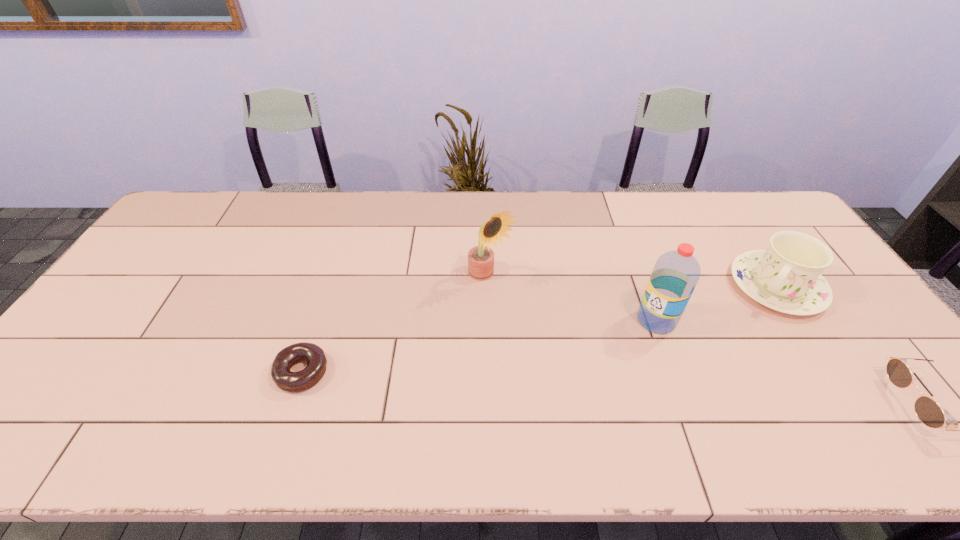
Where is `the shortest object`? This screenshot has width=960, height=540. the shortest object is located at coordinates (286, 380).

The height and width of the screenshot is (540, 960). Find the location of `the leftmost object`. the leftmost object is located at coordinates (286, 380).

This screenshot has width=960, height=540. Identify the location of chinaware. click(786, 277).

Locate an element on the screen. Image resolution: width=960 pixels, height=540 pixels. the fourth object from right to left is located at coordinates (480, 258).

Locate an element on the screen. Image resolution: width=960 pixels, height=540 pixels. water bottle is located at coordinates (675, 275).

Where is `free location located 0.080m on the right of the leftmost object`? The image size is (960, 540). free location located 0.080m on the right of the leftmost object is located at coordinates (361, 372).

Find the location of a particular element. blank area located on the handle side of the third tallest object is located at coordinates point(736,342).

Locate an element on the screen. free location located 0.370m on the handle side of the third tallest object is located at coordinates point(698,395).

Image resolution: width=960 pixels, height=540 pixels. In order to click on vacant space located on the handle side of the third tallest object in this screenshot , I will do `click(696, 397)`.

Identify the location of vacant space situated on the face of the sunflower. This screenshot has height=540, width=960. (543, 326).